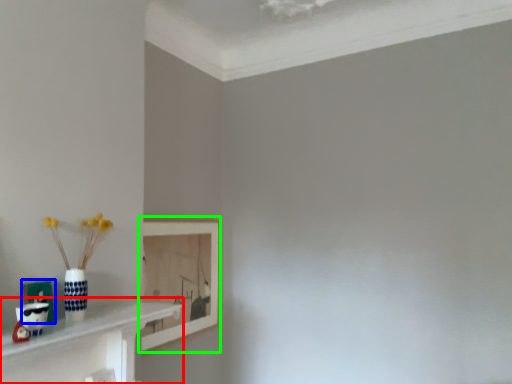
Question: Which is farther away from shelf (highlighted by a red box)? picture frame (highlighted by a blue box) or picture frame (highlighted by a green box)?

Choices:
 (A) picture frame
 (B) picture frame

Answer: (B)